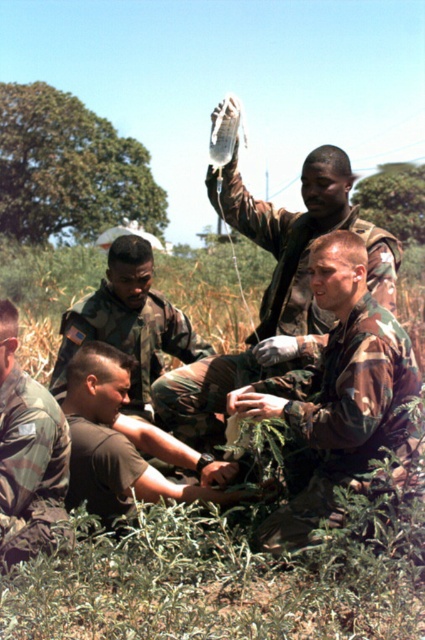
You are a member of the military unit in the image. You need to move from your current position at the camouflage uniform at lower left to the camouflage fabric uniform at center to receive instructions. Can you move directly to them without needing to go around any obstacles?

The distance between the camouflage fabric uniform at center and the camouflage uniform at lower left is 1.04 meters, so you can move directly to them without needing to go around any obstacles since the distance is short enough to move freely.